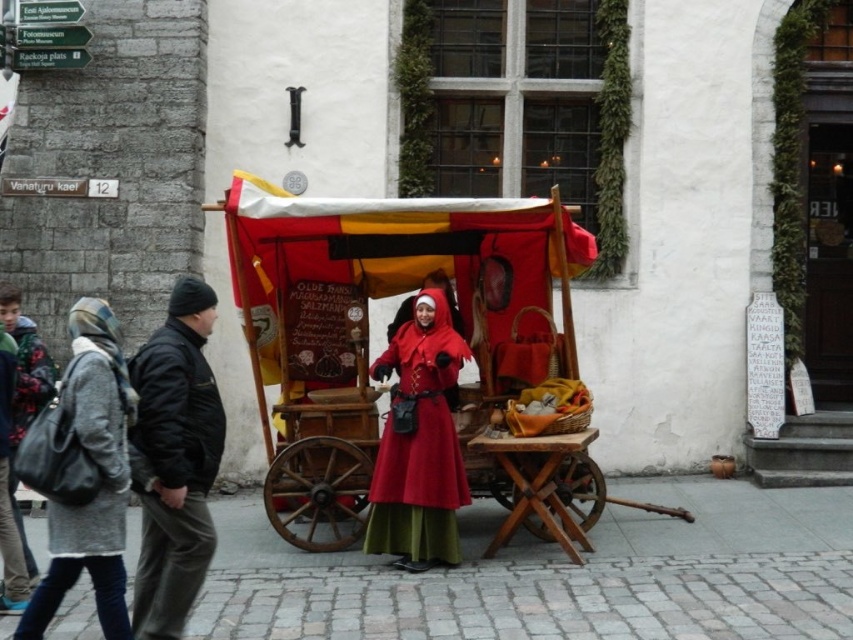
You are a tourist standing on the cobblestone street and want to take a photo of both the red fabric cart at center and the matte red coat at center. Since you want both in the frame, which object should you position closer to the camera to ensure both are visible?

The red fabric cart at center is to the right of matte red coat at center, so positioning the matte red coat at center closer to the camera will keep both objects within the frame while accounting for their spatial arrangement.

You are standing on the cobblestone street in the scene and want to walk to both the point at coordinates (392, 602) and the point at (289, 284). Which point will you reach first?

You will reach the point at coordinates (392, 602) first because it is closer to you than the point at (289, 284).